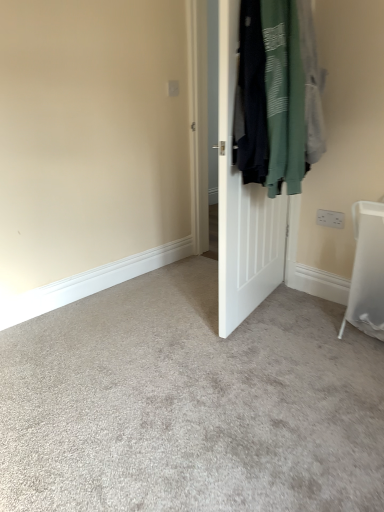
What is the approximate width of dark green cotton sweatshirt at right?

dark green cotton sweatshirt at right is 13.00 inches in width.

Find the location of a particular element. This screenshot has width=384, height=512. dark green cotton sweatshirt at right is located at coordinates (278, 94).

Describe the element at coordinates (242, 206) in the screenshot. Image resolution: width=384 pixels, height=512 pixels. I see `white matte door at center` at that location.

The height and width of the screenshot is (512, 384). I want to click on white plastic electric outlet at upper right, so click(x=330, y=218).

Is dark green cotton sweatshirt at right directly adjacent to white plastic electric outlet at upper right?

No, dark green cotton sweatshirt at right is not in contact with white plastic electric outlet at upper right.

Which of these two, dark green cotton sweatshirt at right or white plastic electric outlet at upper right, is smaller?

With smaller size is white plastic electric outlet at upper right.

Is point (241, 84) closer or farther from the camera than point (332, 227)?

Point (241, 84) appears to be closer to the viewer than point (332, 227).

Does dark green cotton sweatshirt at right turn towards white plastic electric outlet at upper right?

No.

Is white matte door at center aimed at white plastic electric outlet at upper right?

No, white matte door at center does not turn towards white plastic electric outlet at upper right.

Consider the image. Considering the relative positions of white matte door at center and white plastic electric outlet at upper right in the image provided, is white matte door at center to the right of white plastic electric outlet at upper right from the viewer's perspective?

In fact, white matte door at center is to the left of white plastic electric outlet at upper right.

From a real-world perspective, does white matte door at center sit lower than white plastic electric outlet at upper right?

Actually, white matte door at center is physically above white plastic electric outlet at upper right in the real world.

Based on their sizes in the image, would you say white plastic electric outlet at upper right is bigger or smaller than dark green cotton sweatshirt at right?

Considering their sizes, white plastic electric outlet at upper right takes up less space than dark green cotton sweatshirt at right.

Does point (322, 223) appear closer or farther from the camera than point (307, 143)?

Point (322, 223) appears to be farther away from the viewer than point (307, 143).

Considering the positions of objects white plastic electric outlet at upper right and dark green cotton sweatshirt at right in the image provided, who is more to the left, white plastic electric outlet at upper right or dark green cotton sweatshirt at right?

dark green cotton sweatshirt at right is more to the left.

From a real-world perspective, is white plastic electric outlet at upper right on dark green cotton sweatshirt at right?

Incorrect, from a real-world perspective, white plastic electric outlet at upper right is lower than dark green cotton sweatshirt at right.

Does dark green cotton sweatshirt at right lie in front of white matte door at center?

Yes, the depth of dark green cotton sweatshirt at right is less than that of white matte door at center.

Find the location of a particular element. The width and height of the screenshot is (384, 512). door below the dark green cotton sweatshirt at right (from a real-world perspective) is located at coordinates (242, 206).

In the scene shown: Is there a large distance between dark green cotton sweatshirt at right and white matte door at center?

No.

Is dark green cotton sweatshirt at right taller or shorter than white matte door at center?

Clearly, dark green cotton sweatshirt at right is shorter compared to white matte door at center.

In terms of height, does white plastic electric outlet at upper right look taller or shorter compared to white matte door at center?

In the image, white plastic electric outlet at upper right appears to be shorter than white matte door at center.

What's the angular difference between white plastic electric outlet at upper right and white matte door at center's facing directions?

78.9 degrees.

Consider the image. Are white plastic electric outlet at upper right and white matte door at center beside each other?

No, white plastic electric outlet at upper right is not with white matte door at center.

From the image's perspective, who appears lower, white plastic electric outlet at upper right or white matte door at center?

white plastic electric outlet at upper right appears lower in the image.

From a real-world perspective, which object rests below the other?

white matte door at center, from a real-world perspective.

Is white matte door at center inside the boundaries of dark green cotton sweatshirt at right, or outside?

white matte door at center exists outside the volume of dark green cotton sweatshirt at right.

Is the depth of white matte door at center greater than that of dark green cotton sweatshirt at right?

Yes.

Which point is more distant from viewer, (248, 274) or (241, 9)?

The point (248, 274) is behind.

This screenshot has width=384, height=512. I want to click on laundry above the white plastic electric outlet at upper right (from a real-world perspective), so click(278, 94).

Find the location of a particular element. The image size is (384, 512). door to the left of white plastic electric outlet at upper right is located at coordinates (242, 206).

Based on their spatial positions, is dark green cotton sweatshirt at right or white matte door at center closer to white plastic electric outlet at upper right?

Based on the image, white matte door at center appears to be nearer to white plastic electric outlet at upper right.

Consider the image. Estimate the real-world distances between objects in this image. Which object is further from white matte door at center, white plastic electric outlet at upper right or dark green cotton sweatshirt at right?

white plastic electric outlet at upper right is positioned further to the anchor white matte door at center.

Estimate the real-world distances between objects in this image. Which object is further from dark green cotton sweatshirt at right, white plastic electric outlet at upper right or white matte door at center?

white plastic electric outlet at upper right lies further to dark green cotton sweatshirt at right than the other object.

Looking at the image, which one is located further to dark green cotton sweatshirt at right, white matte door at center or white plastic electric outlet at upper right?

white plastic electric outlet at upper right lies further to dark green cotton sweatshirt at right than the other object.

Based on their spatial positions, is white matte door at center or dark green cotton sweatshirt at right further from white plastic electric outlet at upper right?

dark green cotton sweatshirt at right is positioned further to the anchor white plastic electric outlet at upper right.

Considering their positions, is dark green cotton sweatshirt at right positioned further to white matte door at center than white plastic electric outlet at upper right?

Based on the image, white plastic electric outlet at upper right appears to be further to white matte door at center.

At what (x,y) coordinates should I click in order to perform the action: click on door between dark green cotton sweatshirt at right and white plastic electric outlet at upper right from front to back. Please return your answer as a coordinate pair (x, y). The width and height of the screenshot is (384, 512). Looking at the image, I should click on (242, 206).